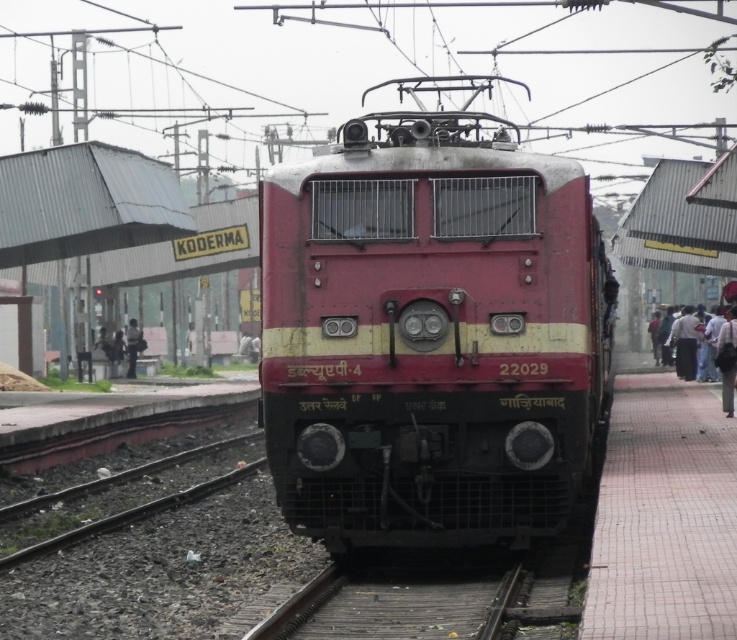
Question: Can you confirm if red matte train at center is positioned to the left of brown wooden train track at center?

Choices:
 (A) no
 (B) yes

Answer: (A)

Question: Considering the real-world distances, which object is closest to the dark blue jeans at right?

Choices:
 (A) dark gray fabric pants at right
 (B) dark gray fabric jacket at left

Answer: (A)

Question: Is red matte train at center further to camera compared to dark gray fabric pants at right?

Choices:
 (A) no
 (B) yes

Answer: (A)

Question: Among these objects, which one is nearest to the camera?

Choices:
 (A) dark gray fabric people at right
 (B) brown wooden train track at center
 (C) red matte train at center

Answer: (B)

Question: Is dark blue jeans at right further to the viewer compared to dark gray fabric jacket at left?

Choices:
 (A) no
 (B) yes

Answer: (A)

Question: Which point is farther to the camera?

Choices:
 (A) dark gray fabric pants at right
 (B) dark gray fabric jacket at left

Answer: (B)